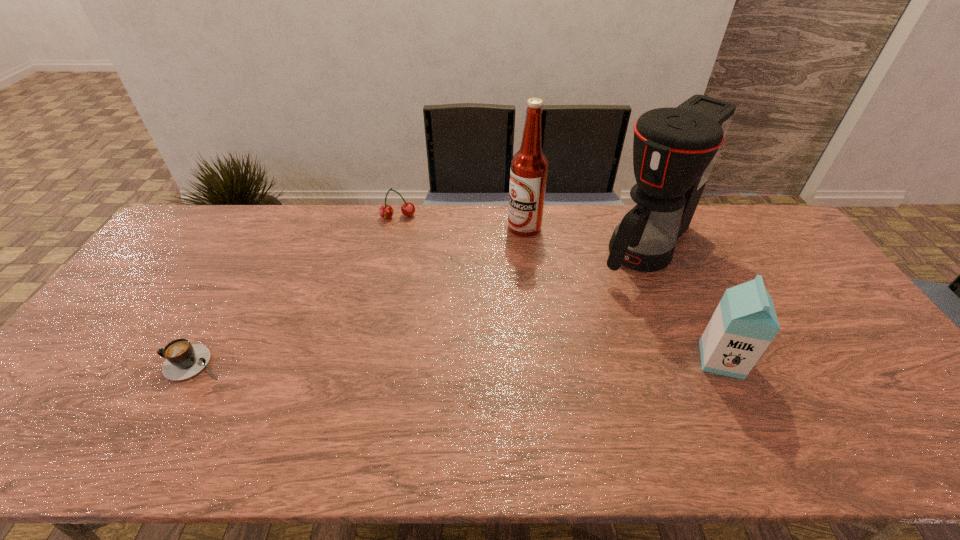
At what (x,y) coordinates should I click in order to perform the action: click on the shortest object. Please return your answer as a coordinate pair (x, y). This screenshot has height=540, width=960. Looking at the image, I should click on (183, 360).

The image size is (960, 540). I want to click on the leftmost object, so click(183, 360).

Find the location of `milk carton`. milk carton is located at coordinates (744, 323).

Find the location of a particular element. the second object from left to right is located at coordinates (386, 211).

What are the coordinates of `the fourth tallest object` in the screenshot? It's located at (386, 211).

Locate an element on the screen. The image size is (960, 540). alcohol is located at coordinates (529, 166).

The width and height of the screenshot is (960, 540). Identify the location of coffee maker. (674, 149).

The image size is (960, 540). I want to click on free space located with the handle on the side of the shortest object, so click(84, 363).

The height and width of the screenshot is (540, 960). What are the coordinates of `vacant area located with the handle on the side of the shortest object` in the screenshot? It's located at (143, 363).

The image size is (960, 540). In order to click on vacant space located with the handle on the side of the shortest object in this screenshot , I will do `click(77, 363)`.